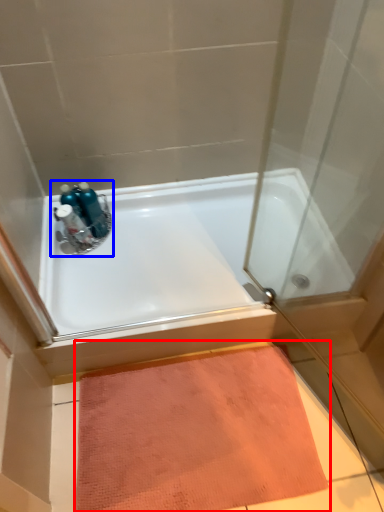
Question: Which point is closer to the camera, doormat (highlighted by a red box) or sink (highlighted by a blue box)?

Choices:
 (A) doormat
 (B) sink

Answer: (A)